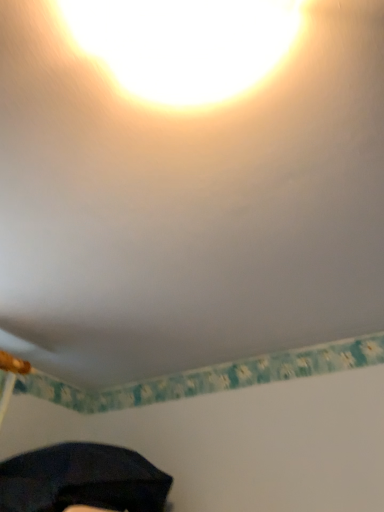
Locate an element on the screen. The image size is (384, 512). matte yellow light at upper center is located at coordinates click(x=185, y=45).

The image size is (384, 512). What do you see at coordinates (185, 45) in the screenshot?
I see `matte yellow light at upper center` at bounding box center [185, 45].

Where is `dark matte umbrella at lower left`? dark matte umbrella at lower left is located at coordinates (82, 480).

Image resolution: width=384 pixels, height=512 pixels. Describe the element at coordinates (82, 480) in the screenshot. I see `dark matte umbrella at lower left` at that location.

Locate an element on the screen. This screenshot has width=384, height=512. matte yellow light at upper center is located at coordinates (185, 45).

Considering the positions of objects matte yellow light at upper center and dark matte umbrella at lower left in the image provided, who is more to the left, matte yellow light at upper center or dark matte umbrella at lower left?

Positioned to the left is dark matte umbrella at lower left.

Is the position of matte yellow light at upper center more distant than that of dark matte umbrella at lower left?

No, matte yellow light at upper center is closer to the camera.

Does point (203, 15) lie behind point (79, 488)?

No.

From the image's perspective, between matte yellow light at upper center and dark matte umbrella at lower left, which one is located above?

matte yellow light at upper center is shown above in the image.

From a real-world perspective, is matte yellow light at upper center under dark matte umbrella at lower left?

No, from a real-world perspective, matte yellow light at upper center is not below dark matte umbrella at lower left.

Is matte yellow light at upper center thinner than dark matte umbrella at lower left?

Correct, the width of matte yellow light at upper center is less than that of dark matte umbrella at lower left.

From their relative heights in the image, would you say matte yellow light at upper center is taller or shorter than dark matte umbrella at lower left?

Clearly, matte yellow light at upper center is shorter compared to dark matte umbrella at lower left.

In the scene shown: Who is bigger, matte yellow light at upper center or dark matte umbrella at lower left?

Bigger between the two is dark matte umbrella at lower left.

Would you say matte yellow light at upper center is outside dark matte umbrella at lower left?

Yes, matte yellow light at upper center is outside of dark matte umbrella at lower left.

Is matte yellow light at upper center in contact with dark matte umbrella at lower left?

matte yellow light at upper center and dark matte umbrella at lower left are not in contact.

In the scene shown: Is matte yellow light at upper center oriented towards dark matte umbrella at lower left?

No, matte yellow light at upper center is not aimed at dark matte umbrella at lower left.

How far apart are matte yellow light at upper center and dark matte umbrella at lower left?

matte yellow light at upper center and dark matte umbrella at lower left are 3.55 feet apart.

Image resolution: width=384 pixels, height=512 pixels. What are the coordinates of `light on the right of dark matte umbrella at lower left` in the screenshot? It's located at (185, 45).

Which object is positioned more to the right, dark matte umbrella at lower left or matte yellow light at upper center?

matte yellow light at upper center.

Is the depth of dark matte umbrella at lower left greater than that of matte yellow light at upper center?

Yes, dark matte umbrella at lower left is further from the viewer.

Between point (148, 465) and point (129, 46), which one is positioned behind?

Positioned behind is point (148, 465).

From the image's perspective, is dark matte umbrella at lower left located above or below matte yellow light at upper center?

dark matte umbrella at lower left is situated lower than matte yellow light at upper center in the image.

From a real-world perspective, which object stands above the other?

matte yellow light at upper center is physically above.

Considering the sizes of objects dark matte umbrella at lower left and matte yellow light at upper center in the image provided, who is wider, dark matte umbrella at lower left or matte yellow light at upper center?

With larger width is dark matte umbrella at lower left.

In terms of height, does dark matte umbrella at lower left look taller or shorter compared to matte yellow light at upper center?

Considering their sizes, dark matte umbrella at lower left has more height than matte yellow light at upper center.

Who is bigger, dark matte umbrella at lower left or matte yellow light at upper center?

Bigger between the two is dark matte umbrella at lower left.

Is dark matte umbrella at lower left not inside matte yellow light at upper center?

Indeed, dark matte umbrella at lower left is completely outside matte yellow light at upper center.

Is dark matte umbrella at lower left next to matte yellow light at upper center?

dark matte umbrella at lower left is not next to matte yellow light at upper center, and they're not touching.

Could you tell me if dark matte umbrella at lower left is facing matte yellow light at upper center?

No, dark matte umbrella at lower left does not turn towards matte yellow light at upper center.

What's the angular difference between dark matte umbrella at lower left and matte yellow light at upper center's facing directions?

They differ by 89.7 degrees in their facing directions.

The width and height of the screenshot is (384, 512). I want to click on umbrella behind the matte yellow light at upper center, so click(x=82, y=480).

Locate an element on the screen. light that is on the right side of dark matte umbrella at lower left is located at coordinates (185, 45).

In order to click on light that is in front of the dark matte umbrella at lower left in this screenshot , I will do `click(185, 45)`.